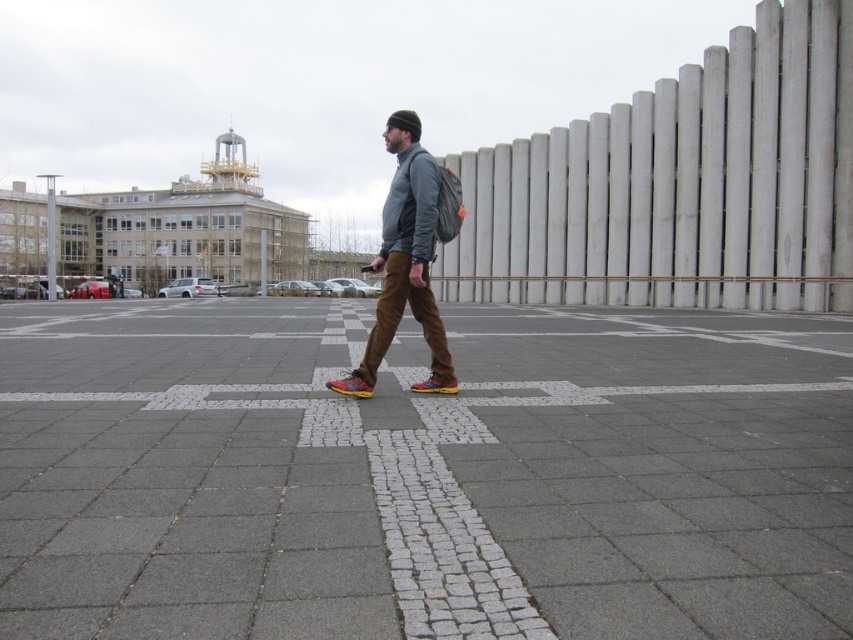
You are a delivery person trying to place a pair of shoes on a narrow shelf. You have a multicolored leather shoe at center and a multicolored synthetic shoe at center. Which shoe should you choose to ensure it fits on the shelf without exceeding the shelf width?

The multicolored leather shoe at center has a lesser width compared to the multicolored synthetic shoe at center, so you should choose the multicolored leather shoe at center to fit on the narrow shelf.

Based on the photo, you are a pedestrian standing on the gray cobblestone pavement at center and the matte gray jacket at center is in your path. Can you step around it without leaving the pavement?

The gray cobblestone pavement at center is larger in size than the matte gray jacket at center, so yes, you can step around it while staying on the pavement.

You are standing at the point labeled as point (x=422, y=474) in the image. What type of pavement are you currently standing on?

The point (x=422, y=474) is on gray cobblestone pavement at center.